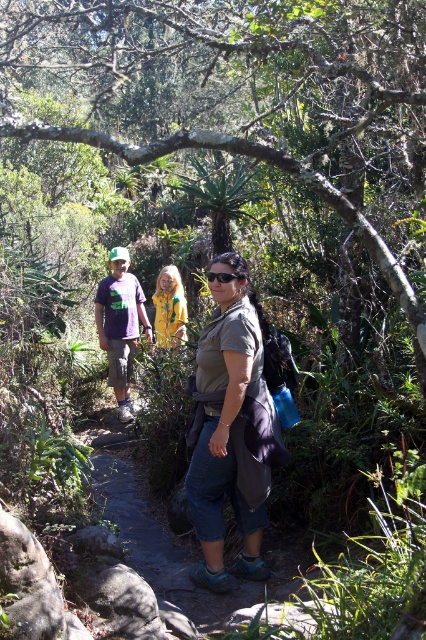
Question: Which of the following is the closest to the observer?

Choices:
 (A) (224, 380)
 (B) (216, 275)
 (C) (160, 342)

Answer: (A)

Question: Where is yellow fabric jacket at center located in relation to black matte goggles at center in the image?

Choices:
 (A) left
 (B) right

Answer: (A)

Question: Does yellow fabric jacket at center appear on the left side of black matte goggles at center?

Choices:
 (A) no
 (B) yes

Answer: (B)

Question: Is yellow fabric jacket at center smaller than black matte goggles at center?

Choices:
 (A) yes
 (B) no

Answer: (B)

Question: Which of the following is the closest to the observer?

Choices:
 (A) click(x=173, y=292)
 (B) click(x=255, y=572)

Answer: (B)

Question: Which of the following is the closest to the observer?

Choices:
 (A) purple cotton shirt at center
 (B) yellow fabric jacket at center
 (C) matte khaki shirt at center
 (D) black matte goggles at center

Answer: (C)